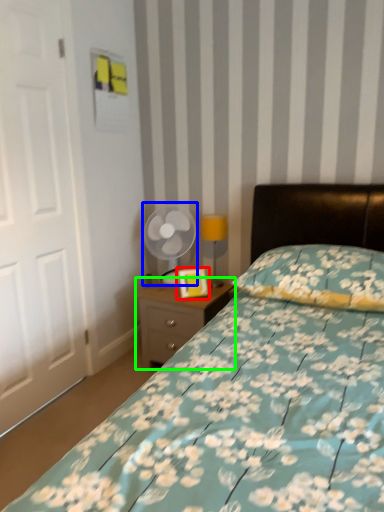
Question: Which object is positioned closest to picture frame (highlighted by a red box)? Select from mechanical fan (highlighted by a blue box) and nightstand (highlighted by a green box).

Choices:
 (A) mechanical fan
 (B) nightstand

Answer: (B)